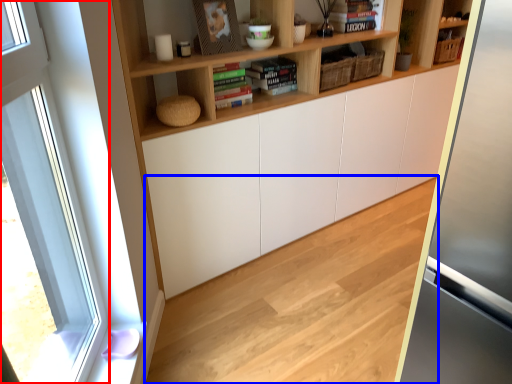
Question: Which of the following is the farthest to the observer, window (highlighted by a red box) or hardwood (highlighted by a blue box)?

Choices:
 (A) window
 (B) hardwood

Answer: (B)